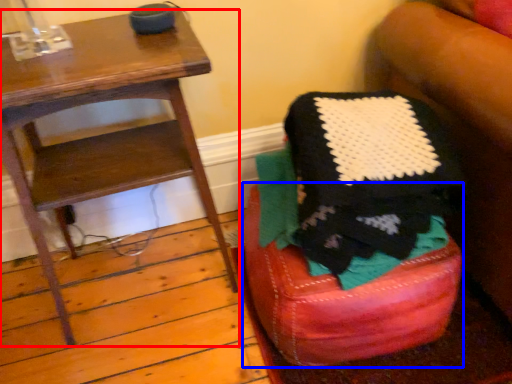
Question: Which object is further to the camera taking this photo, furniture (highlighted by a red box) or bar stool (highlighted by a blue box)?

Choices:
 (A) furniture
 (B) bar stool

Answer: (B)